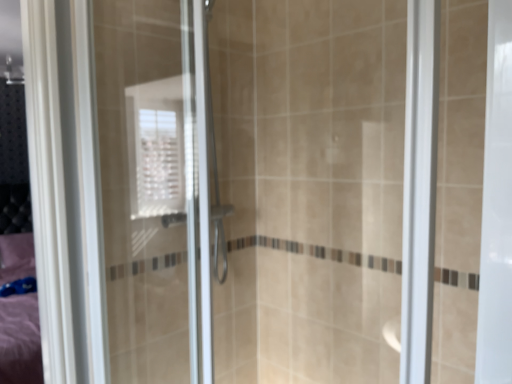
The width and height of the screenshot is (512, 384). What do you see at coordinates (156, 147) in the screenshot?
I see `white textured window at upper center` at bounding box center [156, 147].

From the picture: Measure the distance between point (134, 91) and camera.

1.07 meters.

This screenshot has width=512, height=384. In order to click on white textured window at upper center in this screenshot , I will do [156, 147].

Identify the location of white textured window at upper center. The height and width of the screenshot is (384, 512). (156, 147).